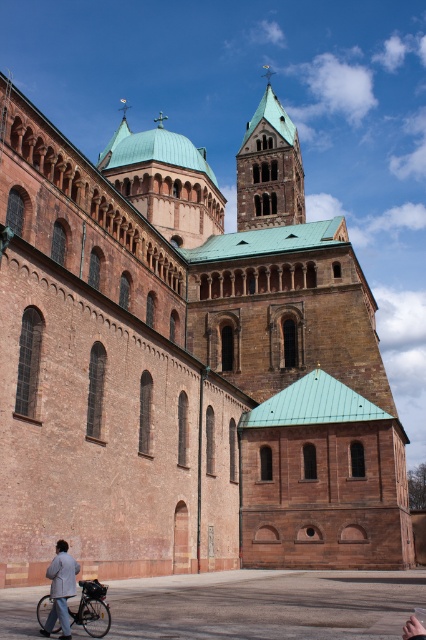
Question: Which object appears closest to the camera in this image?

Choices:
 (A) silver metallic bicycle at lower left
 (B) brown stone tower at upper center

Answer: (A)

Question: Does brown stone tower at upper center have a greater width compared to silver metallic bicycle at lower left?

Choices:
 (A) no
 (B) yes

Answer: (B)

Question: Is brown stone tower at upper center positioned at the back of light gray fabric jacket at lower left?

Choices:
 (A) yes
 (B) no

Answer: (A)

Question: Which of these objects is positioned farthest from the silver metallic bicycle at lower left?

Choices:
 (A) brown stone tower at upper center
 (B) light gray fabric jacket at lower left

Answer: (A)

Question: Which object is positioned farthest from the brown stone tower at upper center?

Choices:
 (A) silver metallic bicycle at lower left
 (B) light gray fabric jacket at lower left

Answer: (B)

Question: Does brown stone tower at upper center have a larger size compared to light gray fabric jacket at lower left?

Choices:
 (A) no
 (B) yes

Answer: (B)